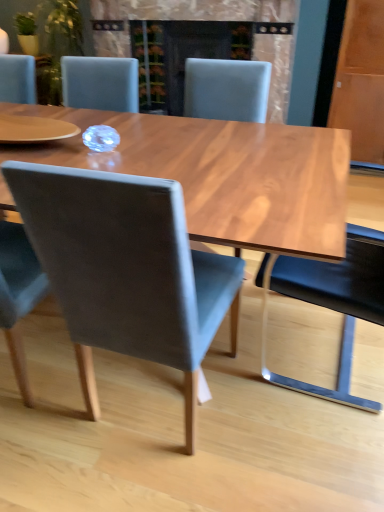
I want to click on vacant space underneath velvet grey chair at center, which is counted as the 3th chair, starting from the right (from a real-world perspective), so click(x=157, y=412).